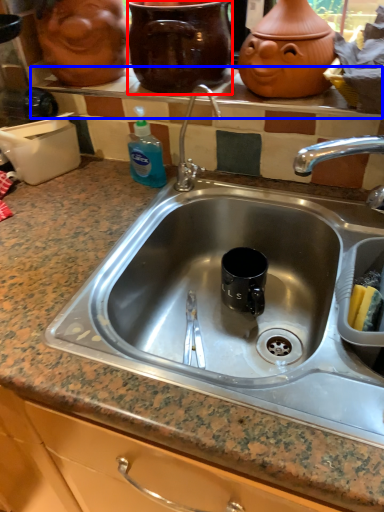
Question: Which point is further to the camera, pottery (highlighted by a red box) or window sill (highlighted by a blue box)?

Choices:
 (A) pottery
 (B) window sill

Answer: (B)